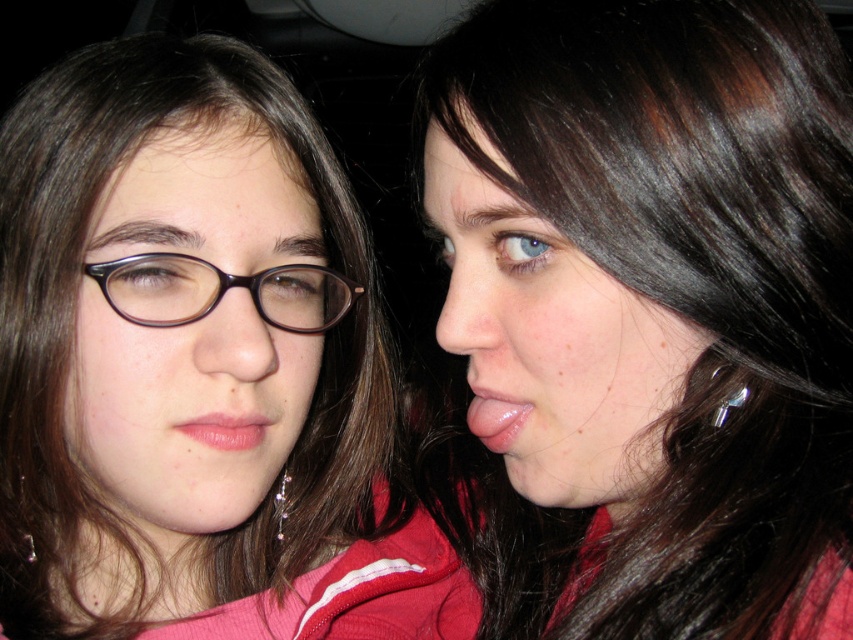
Question: Observing the image, what is the correct spatial positioning of smooth skin face at center in reference to matte brown glasses at left?

Choices:
 (A) right
 (B) left

Answer: (A)

Question: Does smooth skin face at center appear under matte brown glasses at left?

Choices:
 (A) no
 (B) yes

Answer: (B)

Question: Which object is farther from the camera taking this photo?

Choices:
 (A) smooth skin face at center
 (B) matte brown hair at left
 (C) matte brown glasses at left

Answer: (C)

Question: Based on their relative distances, which object is nearer to the matte brown hair at left?

Choices:
 (A) matte brown glasses at left
 (B) smooth skin face at center

Answer: (A)

Question: Which object is closer to the camera taking this photo?

Choices:
 (A) matte brown hair at left
 (B) matte brown glasses at left
 (C) smooth skin face at center

Answer: (C)

Question: Is matte brown hair at left to the left of matte brown glasses at left from the viewer's perspective?

Choices:
 (A) no
 (B) yes

Answer: (B)